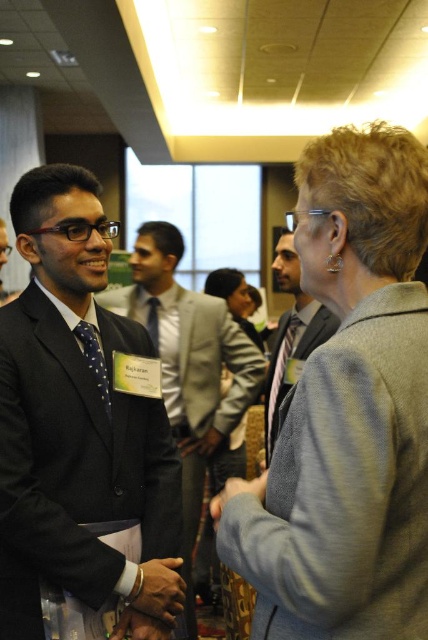
Question: Does gray woolen jacket at upper right appear over light gray suit at center?

Choices:
 (A) yes
 (B) no

Answer: (B)

Question: Is gray woolen jacket at upper right closer to camera compared to matte blue tie at center?

Choices:
 (A) no
 (B) yes

Answer: (B)

Question: Which object is positioned farthest from the polka dot silk tie at left?

Choices:
 (A) striped fabric tie at center
 (B) matte blue tie at center
 (C) light gray suit at center

Answer: (B)

Question: Observing the image, what is the correct spatial positioning of polished dark suit at left in reference to polka dot silk tie at left?

Choices:
 (A) below
 (B) above

Answer: (A)

Question: Which point is farther to the camera?

Choices:
 (A) (155, 339)
 (B) (279, 356)

Answer: (A)

Question: Which of the following is the farthest from the observer?

Choices:
 (A) (231, 298)
 (B) (107, 384)
 (C) (82, 538)

Answer: (A)